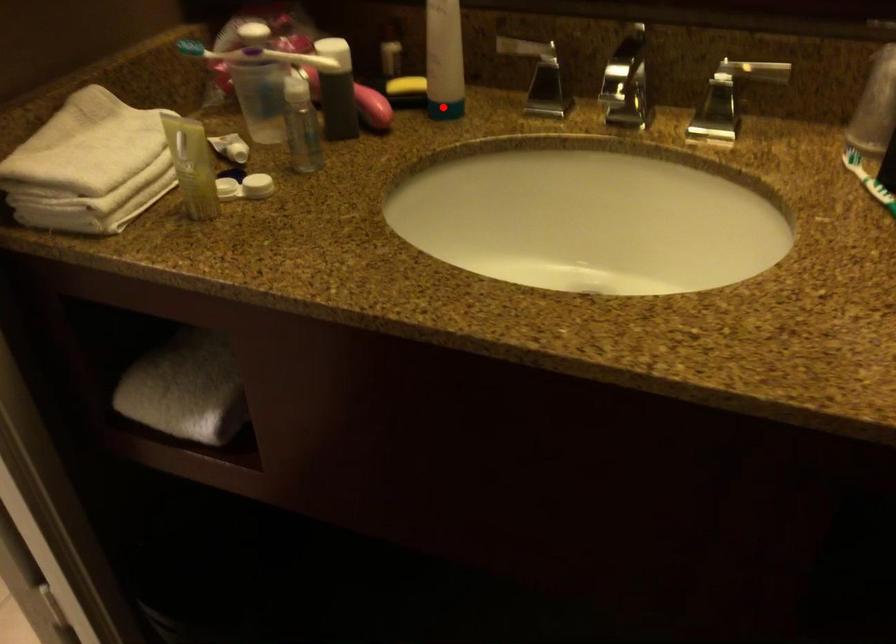
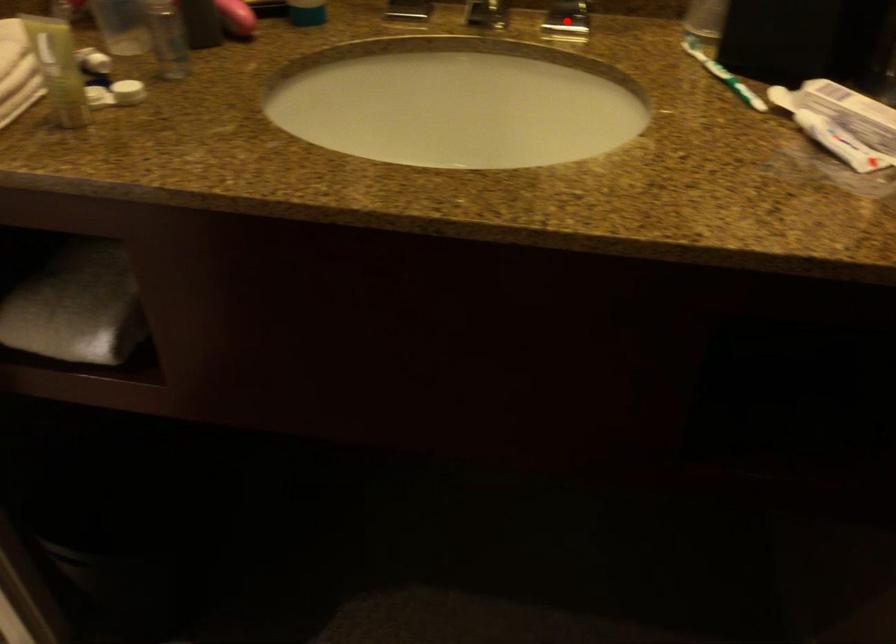
I am providing you with two images of the same scene from different viewpoints. A red point is marked on the first image and another point is marked on the second image. Is the red point in image1 aligned with the point shown in image2?

No